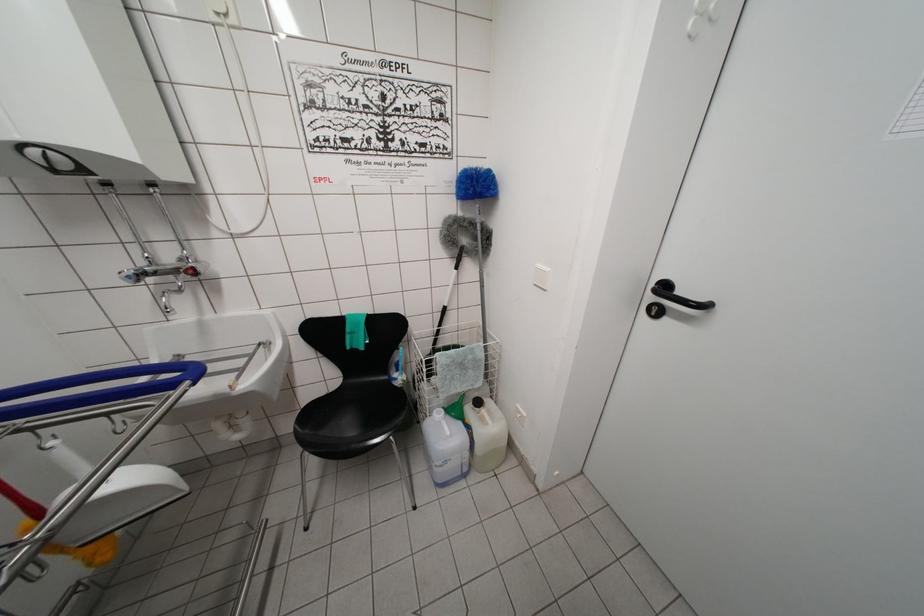
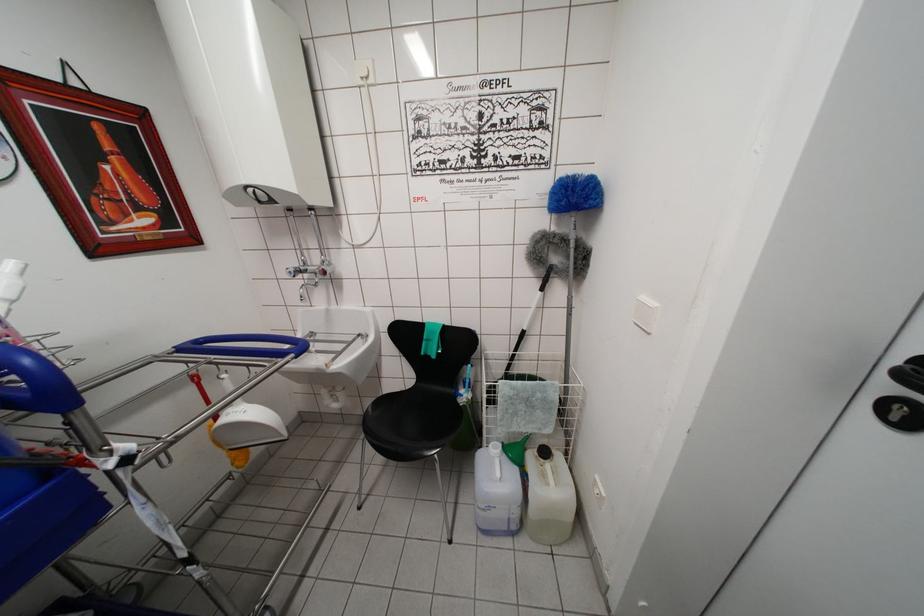
Find the pixel in the second image that matches [444,330] in the first image.

(518, 354)